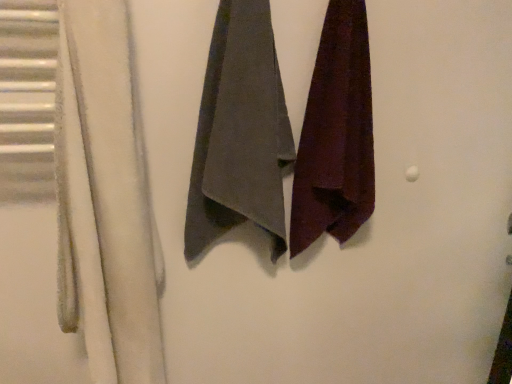
Question: Is velvet maroon towel at right, positioned as the first towel in right-to-left order, inside white fuzzy towel at left?

Choices:
 (A) no
 (B) yes

Answer: (A)

Question: From a real-world perspective, is white fuzzy towel at left on top of velvet maroon towel at right, acting as the second towel starting from the left?

Choices:
 (A) yes
 (B) no

Answer: (B)

Question: Does white fuzzy towel at left have a smaller size compared to velvet maroon towel at right, positioned as the first towel in right-to-left order?

Choices:
 (A) no
 (B) yes

Answer: (A)

Question: Considering the relative sizes of white fuzzy towel at left and velvet maroon towel at right, acting as the second towel starting from the left, in the image provided, is white fuzzy towel at left taller than velvet maroon towel at right, acting as the second towel starting from the left,?

Choices:
 (A) yes
 (B) no

Answer: (A)

Question: Considering the relative sizes of white fuzzy towel at left and velvet maroon towel at right, acting as the second towel starting from the left, in the image provided, is white fuzzy towel at left thinner than velvet maroon towel at right, acting as the second towel starting from the left,?

Choices:
 (A) no
 (B) yes

Answer: (A)

Question: From the image's perspective, is velvet maroon towel at right, acting as the second towel starting from the left, above or below white fuzzy towel at left?

Choices:
 (A) below
 (B) above

Answer: (B)

Question: From their relative heights in the image, would you say velvet maroon towel at right, positioned as the first towel in right-to-left order, is taller or shorter than white fuzzy towel at left?

Choices:
 (A) short
 (B) tall

Answer: (A)

Question: In terms of size, does velvet maroon towel at right, acting as the second towel starting from the left, appear bigger or smaller than white fuzzy towel at left?

Choices:
 (A) big
 (B) small

Answer: (B)

Question: From a real-world perspective, relative to white fuzzy towel at left, is velvet maroon towel at right, positioned as the first towel in right-to-left order, vertically above or below?

Choices:
 (A) above
 (B) below

Answer: (A)

Question: In terms of height, does gray cotton towel at center, the first towel positioned from the left, look taller or shorter compared to velvet maroon towel at right, acting as the second towel starting from the left?

Choices:
 (A) tall
 (B) short

Answer: (B)

Question: From a real-world perspective, relative to velvet maroon towel at right, acting as the second towel starting from the left, is gray cotton towel at center, the 2th towel viewed from the right, vertically above or below?

Choices:
 (A) below
 (B) above

Answer: (A)

Question: Considering the positions of point (229, 6) and point (313, 150), is point (229, 6) closer or farther from the camera than point (313, 150)?

Choices:
 (A) farther
 (B) closer

Answer: (B)

Question: In the image, is gray cotton towel at center, the 2th towel viewed from the right, positioned in front of or behind velvet maroon towel at right, positioned as the first towel in right-to-left order?

Choices:
 (A) behind
 (B) front

Answer: (B)

Question: In the image, is white fuzzy towel at left on the left side or the right side of velvet maroon towel at right, positioned as the first towel in right-to-left order?

Choices:
 (A) right
 (B) left

Answer: (B)

Question: Is white fuzzy towel at left taller or shorter than velvet maroon towel at right, positioned as the first towel in right-to-left order?

Choices:
 (A) short
 (B) tall

Answer: (B)